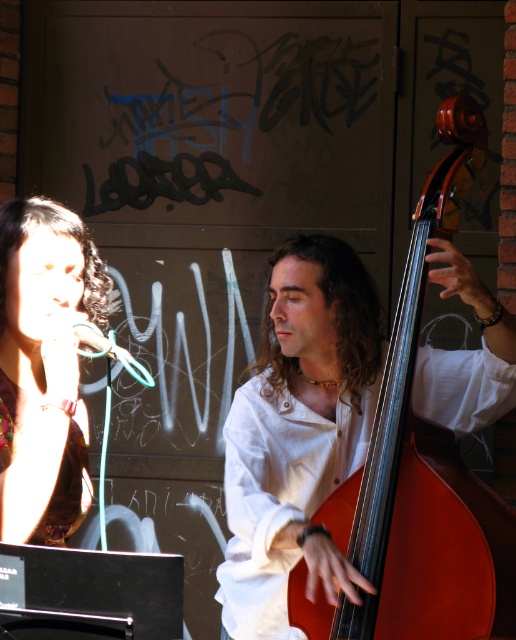
You are a photographer setting up for a shoot. You have a camera with a 1.2 meter wide lens. You need to position it between the shiny brown wood cello at right and the matte brown hair at upper left. Can the lens fit between them without overlapping either object?

The shiny brown wood cello at right might be wider than matte brown hair at upper left, so the lens may not fit between them without overlapping. Check the actual distance first.

You are a photographer standing at the center of the scene. You want to take a closeup shot of the shiny brown wood cello at right. Given that your camera can focus clearly on objects within 8 feet, will you be able to capture the cello in focus without moving closer?

The shiny brown wood cello at right is 8.34 feet away from the viewer. Since the camera can focus clearly within 8 feet, the distance is slightly beyond the camera focus range. Therefore, you will not be able to capture the cello in focus without moving closer.

You are standing at the center of the scene and want to move towards the point labeled as point (43, 397). However, there is an obstacle at point labeled as point (426, 448). Will you encounter this obstacle before reaching your destination?

Yes, you will encounter the obstacle at point (426, 448) before reaching point (43, 397) because point (426, 448) is behind point (43, 397).